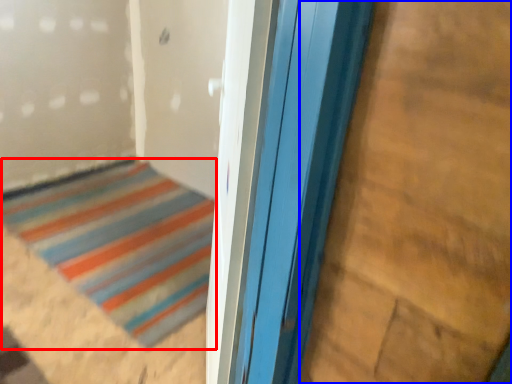
Question: Which object is further to the camera taking this photo, door (highlighted by a red box) or plywood (highlighted by a blue box)?

Choices:
 (A) door
 (B) plywood

Answer: (A)